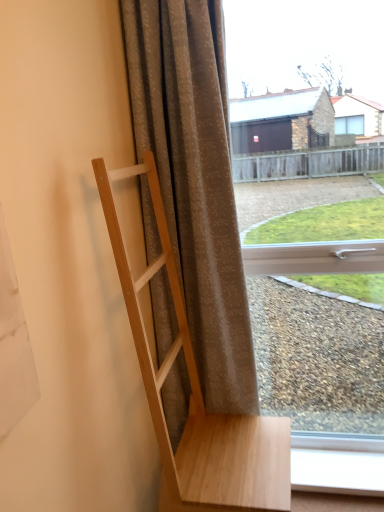
Where is `matte gray curtain at center`? This screenshot has width=384, height=512. matte gray curtain at center is located at coordinates (195, 181).

What is the approximate width of matte gray curtain at center?

It is 19.35 centimeters.

Locate an element on the screen. natural wood coat rack at left is located at coordinates (196, 395).

At what (x,y) coordinates should I click in order to perform the action: click on white plastic window frame at lower right. Please return your answer as a coordinate pair (x, y). The height and width of the screenshot is (512, 384). Looking at the image, I should click on (337, 463).

At what (x,y) coordinates should I click in order to perform the action: click on matte gray curtain at center. Please return your answer as a coordinate pair (x, y). The image size is (384, 512). Looking at the image, I should click on (195, 181).

Identify the location of window above the matte gray curtain at center (from the image's perspective). (335, 468).

Considering the sizes of matte gray curtain at center and transparent glass window at center in the image, is matte gray curtain at center wider or thinner than transparent glass window at center?

Clearly, matte gray curtain at center has more width compared to transparent glass window at center.

Is matte gray curtain at center positioned far away from transparent glass window at center?

No, matte gray curtain at center is not far from transparent glass window at center.

From the image's perspective, is matte gray curtain at center beneath white plastic window frame at lower right?

No, from the image's perspective, matte gray curtain at center is not beneath white plastic window frame at lower right.

Which is behind, matte gray curtain at center or white plastic window frame at lower right?

white plastic window frame at lower right is more distant.

Consider the image. Which object is thinner, matte gray curtain at center or white plastic window frame at lower right?

With smaller width is matte gray curtain at center.

From a real-world perspective, is matte gray curtain at center on white plastic window frame at lower right?

Indeed, from a real-world perspective, matte gray curtain at center stands above white plastic window frame at lower right.

Between natural wood coat rack at left and transparent glass window at center, which one is positioned behind?

Positioned behind is transparent glass window at center.

Looking at the image, does natural wood coat rack at left seem bigger or smaller compared to transparent glass window at center?

natural wood coat rack at left is bigger than transparent glass window at center.

Are natural wood coat rack at left and transparent glass window at center located far from each other?

That's not correct — natural wood coat rack at left is a little close to transparent glass window at center.

Between natural wood coat rack at left and transparent glass window at center, which one appears on the left side from the viewer's perspective?

Positioned to the left is natural wood coat rack at left.

Identify the location of curtain above the natural wood coat rack at left (from a real-world perspective). coord(195,181).

What's the angular difference between matte gray curtain at center and natural wood coat rack at left's facing directions?

88 degrees.

Considering the positions of objects matte gray curtain at center and natural wood coat rack at left in the image provided, who is more to the left, matte gray curtain at center or natural wood coat rack at left?

Positioned to the left is matte gray curtain at center.

Which of these two, transparent glass window at center or white plastic window frame at lower right, is smaller?

white plastic window frame at lower right is smaller.

Between point (297, 467) and point (333, 452), which one is positioned behind?

The point (333, 452) is behind.

From the image's perspective, which object appears higher, transparent glass window at center or white plastic window frame at lower right?

transparent glass window at center.

From a real-world perspective, is transparent glass window at center located beneath white plastic window frame at lower right?

No, from a real-world perspective, transparent glass window at center is not below white plastic window frame at lower right.

Is natural wood coat rack at left positioned far away from white plastic window frame at lower right?

No, natural wood coat rack at left is not far away from white plastic window frame at lower right.

This screenshot has height=512, width=384. Find the location of `window frame below the natural wood coat rack at left (from a real-world perspective)`. window frame below the natural wood coat rack at left (from a real-world perspective) is located at coordinates (337, 463).

Who is shorter, natural wood coat rack at left or white plastic window frame at lower right?

Standing shorter between the two is white plastic window frame at lower right.

From a real-world perspective, is white plastic window frame at lower right over natural wood coat rack at left?

No, from a real-world perspective, white plastic window frame at lower right is not on top of natural wood coat rack at left.

Considering the sizes of objects white plastic window frame at lower right and natural wood coat rack at left in the image provided, who is taller, white plastic window frame at lower right or natural wood coat rack at left?

natural wood coat rack at left.

Between white plastic window frame at lower right and natural wood coat rack at left, which one has larger size?

natural wood coat rack at left is bigger.

Find the location of `curtain positioned vertically above the transparent glass window at center (from a real-world perspective)`. curtain positioned vertically above the transparent glass window at center (from a real-world perspective) is located at coordinates (195, 181).

Find the location of a particular element. window frame directly beneath the matte gray curtain at center (from a real-world perspective) is located at coordinates (x=337, y=463).

From the image, which object appears to be farther from natural wood coat rack at left, transparent glass window at center or matte gray curtain at center?

Based on the image, transparent glass window at center appears to be further to natural wood coat rack at left.

From the picture: Based on their spatial positions, is matte gray curtain at center or white plastic window frame at lower right further from transparent glass window at center?

white plastic window frame at lower right is further to transparent glass window at center.

From the image, which object appears to be farther from white plastic window frame at lower right, matte gray curtain at center or natural wood coat rack at left?

Among the two, matte gray curtain at center is located further to white plastic window frame at lower right.

From the image, which object appears to be farther from white plastic window frame at lower right, natural wood coat rack at left or matte gray curtain at center?

The object further to white plastic window frame at lower right is matte gray curtain at center.

Which object lies further to the anchor point matte gray curtain at center, white plastic window frame at lower right or transparent glass window at center?

Among the two, white plastic window frame at lower right is located further to matte gray curtain at center.

From the image, which object appears to be nearer to matte gray curtain at center, transparent glass window at center or white plastic window frame at lower right?

transparent glass window at center lies closer to matte gray curtain at center than the other object.

Estimate the real-world distances between objects in this image. Which object is closer to transparent glass window at center, matte gray curtain at center or natural wood coat rack at left?

The object closer to transparent glass window at center is matte gray curtain at center.

From the image, which object appears to be farther from matte gray curtain at center, transparent glass window at center or natural wood coat rack at left?

transparent glass window at center.

The width and height of the screenshot is (384, 512). In order to click on curtain between transparent glass window at center and white plastic window frame at lower right vertically in this screenshot , I will do `click(195, 181)`.

The image size is (384, 512). What are the coordinates of `furniture that lies between matte gray curtain at center and white plastic window frame at lower right from top to bottom` in the screenshot? It's located at (196, 395).

Find the location of `furniture between matte gray curtain at center and transparent glass window at center from left to right`. furniture between matte gray curtain at center and transparent glass window at center from left to right is located at coordinates (196, 395).

Find the location of a particular element. Image resolution: width=384 pixels, height=512 pixels. furniture between transparent glass window at center and white plastic window frame at lower right in the vertical direction is located at coordinates (196, 395).